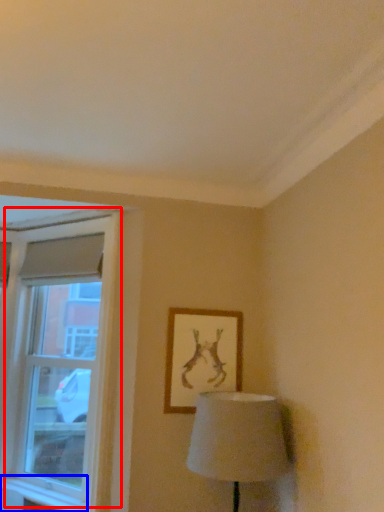
Question: Which point is closer to the camera, window (highlighted by a red box) or window sill (highlighted by a blue box)?

Choices:
 (A) window
 (B) window sill

Answer: (B)